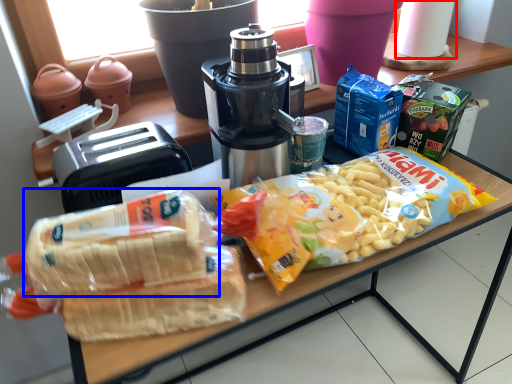
Question: Which object appears farthest to the camera in this image, paper towel (highlighted by a red box) or snack (highlighted by a blue box)?

Choices:
 (A) paper towel
 (B) snack

Answer: (A)